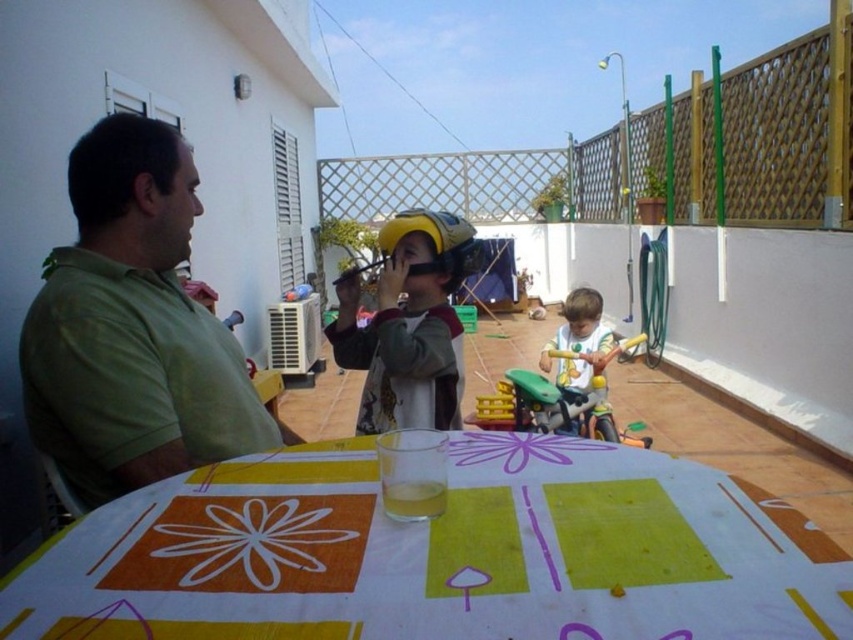
Question: Which point is farther to the camera?

Choices:
 (A) yellow matte helmet at center
 (B) green matte shirt at left
 (C) white plastic toy at center

Answer: (C)

Question: Which point is closer to the camera?

Choices:
 (A) (718, 620)
 (B) (241, 387)
 (C) (369, 321)

Answer: (A)

Question: Which of the following is the closest to the observer?

Choices:
 (A) yellow matte helmet at center
 (B) white plastic toy at center
 (C) green matte shirt at left
 (D) printed fabric table at center

Answer: (D)

Question: Can you confirm if printed fabric table at center is smaller than yellow matte helmet at center?

Choices:
 (A) no
 (B) yes

Answer: (B)

Question: Does printed fabric table at center lie behind green matte shirt at left?

Choices:
 (A) yes
 (B) no

Answer: (B)

Question: Does printed fabric table at center appear under white plastic toy at center?

Choices:
 (A) no
 (B) yes

Answer: (A)